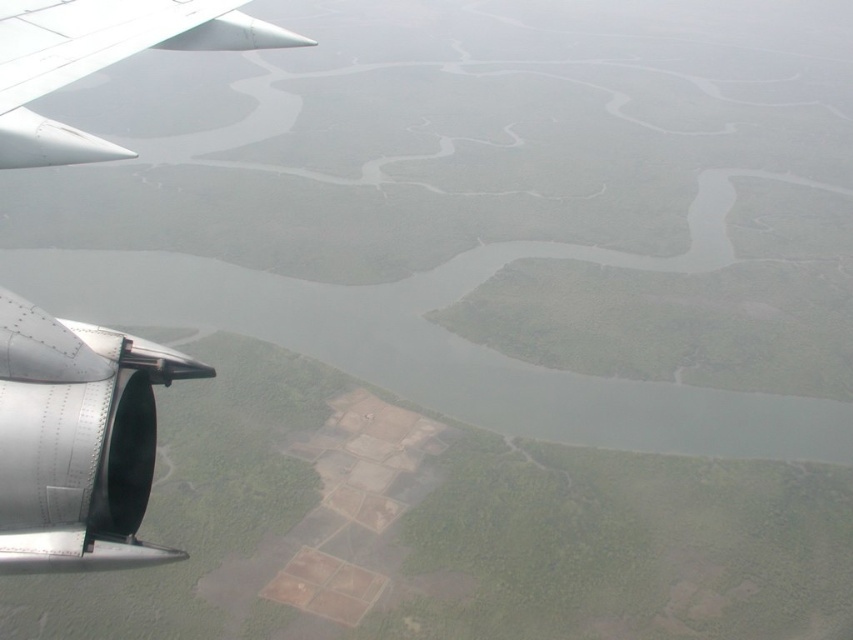
Does metallic silver wing at upper left have a smaller size compared to white matte wing at upper left?

Correct, metallic silver wing at upper left occupies less space than white matte wing at upper left.

Which is behind, point (161, 561) or point (49, 8)?

The point (49, 8) is behind.

Which is in front, point (225, 1) or point (32, 12)?

Positioned in front is point (32, 12).

I want to click on metallic silver wing at upper left, so click(74, 442).